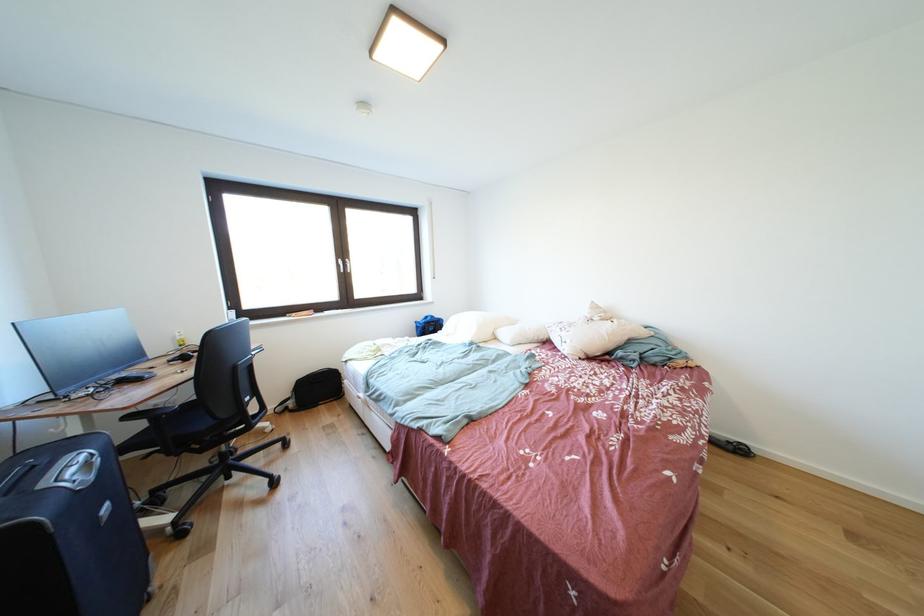
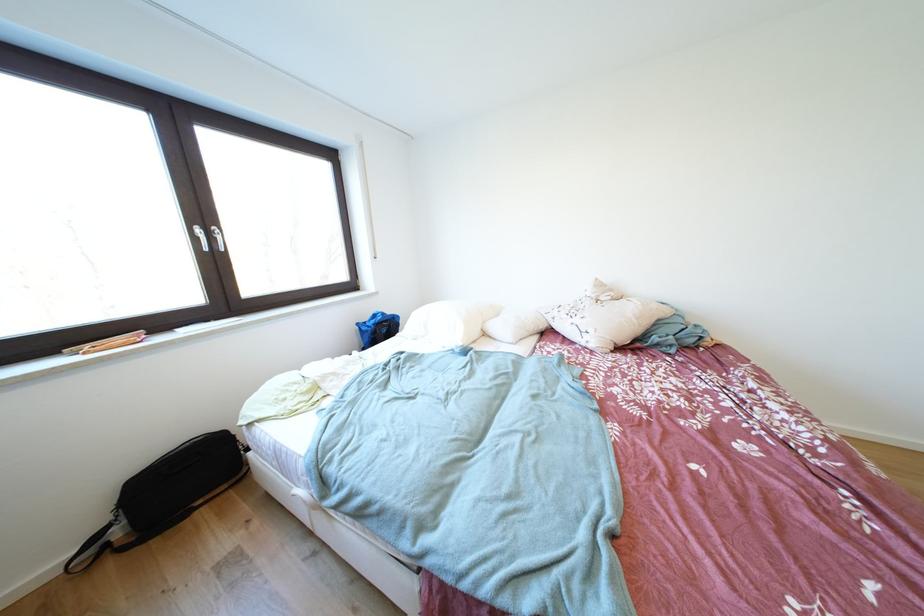
Locate, in the second image, the point that corresponds to [451,325] in the first image.

(407, 321)